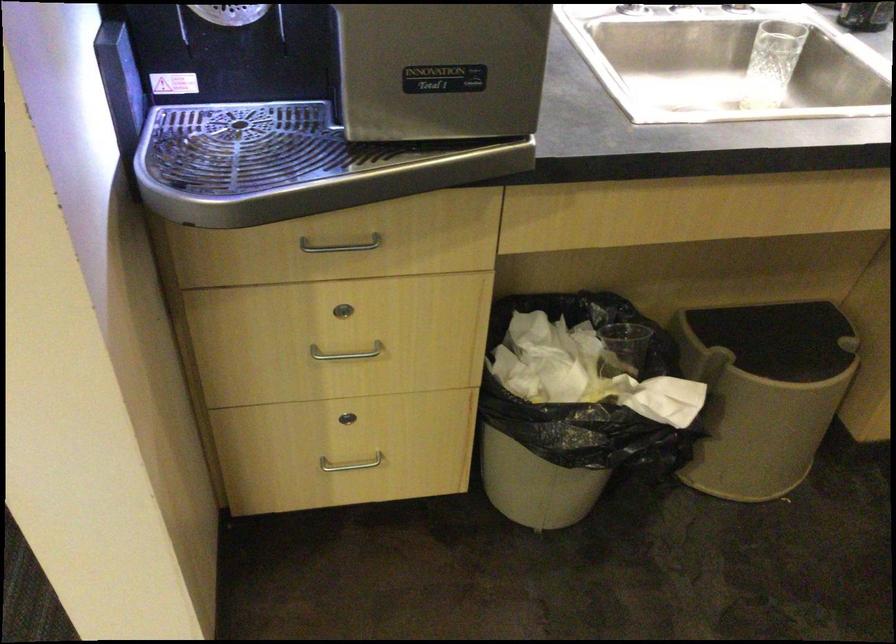
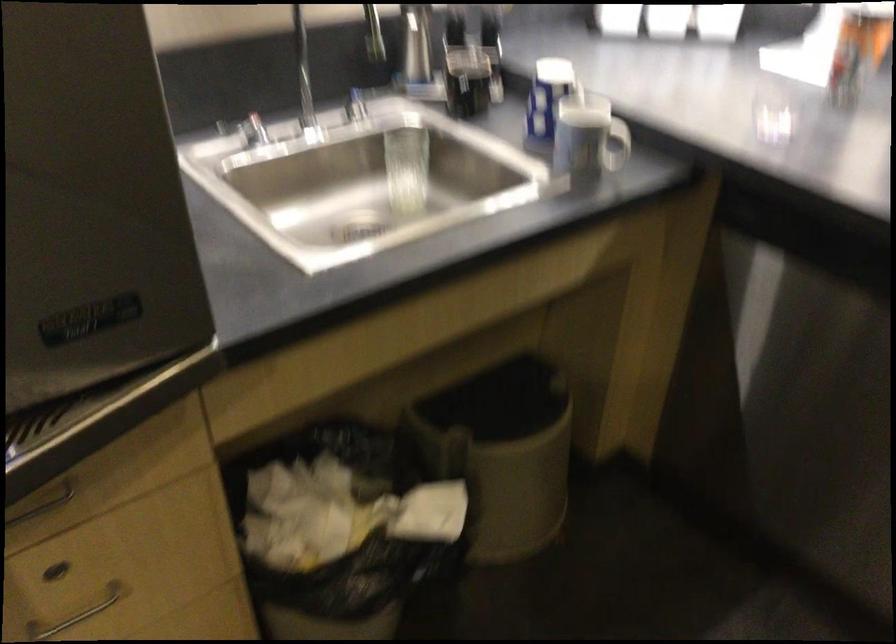
Where in the second image is the point corresponding to pixel 340 353 from the first image?

(76, 614)